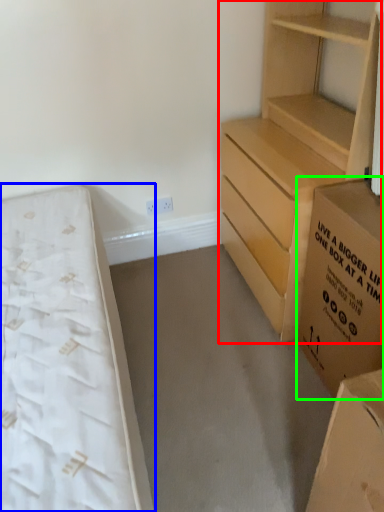
Question: Considering the real-world distances, which object is closest to chest of drawers (highlighted by a red box)? bed (highlighted by a blue box) or cardboard box (highlighted by a green box).

Choices:
 (A) bed
 (B) cardboard box

Answer: (B)